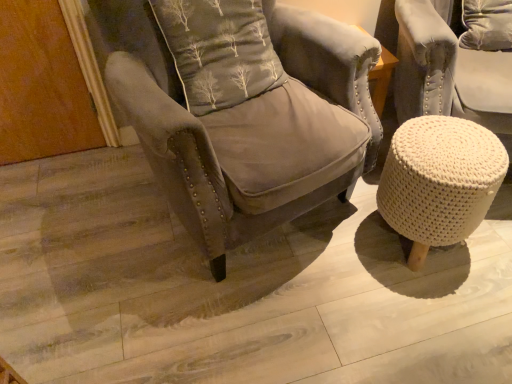
Question: In terms of height, does gray fabric pillow at center look taller or shorter compared to white knitted stool at lower right?

Choices:
 (A) short
 (B) tall

Answer: (B)

Question: Considering the positions of gray fabric pillow at center and white knitted stool at lower right in the image, is gray fabric pillow at center wider or thinner than white knitted stool at lower right?

Choices:
 (A) thin
 (B) wide

Answer: (A)

Question: Which object is positioned farthest from the velvet gray armchair at center?

Choices:
 (A) gray fabric pillow at center
 (B) white knitted stool at lower right

Answer: (B)

Question: Which is farther from the gray fabric pillow at center?

Choices:
 (A) velvet gray armchair at center
 (B) white knitted stool at lower right

Answer: (B)